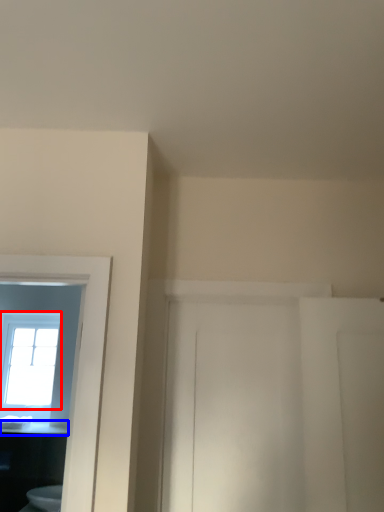
Question: Which point is closer to the camera, window (highlighted by a red box) or counter top (highlighted by a blue box)?

Choices:
 (A) window
 (B) counter top

Answer: (B)